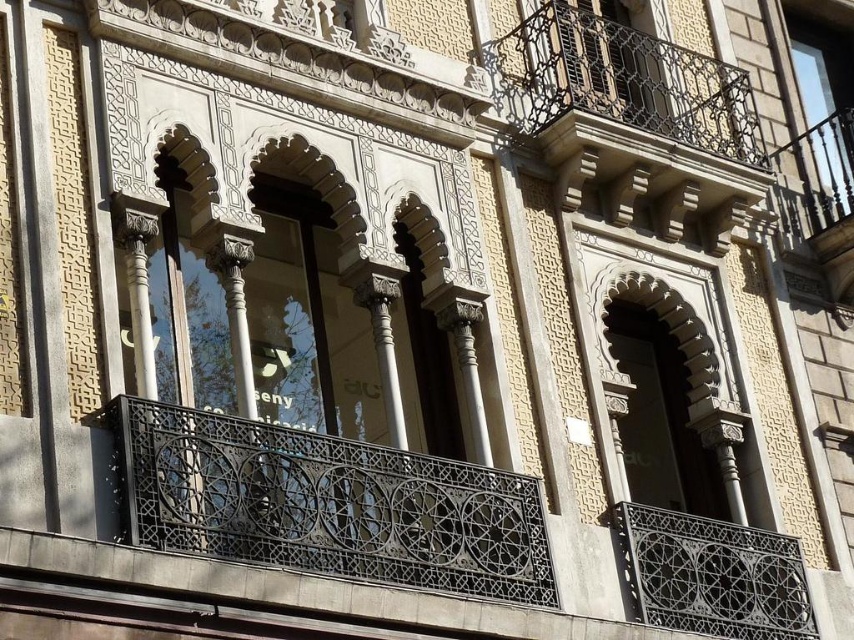
You are standing 100 feet away from the dark gray wrought iron at center. Can you reach it without moving closer?

The dark gray wrought iron at center is 106.18 feet away from the viewer. Since you are standing 100 feet away, you are still 6.18 feet away from it, so you cannot reach it without moving closer.

You are standing in front of the building and looking at the facade. There are two points marked on the image at coordinates point (253, 548) and point (691, 621). Which of these points is nearer to your viewpoint?

Point (253, 548) is closer to the camera than point (691, 621), so the point at (253, 548) is nearer to your viewpoint.